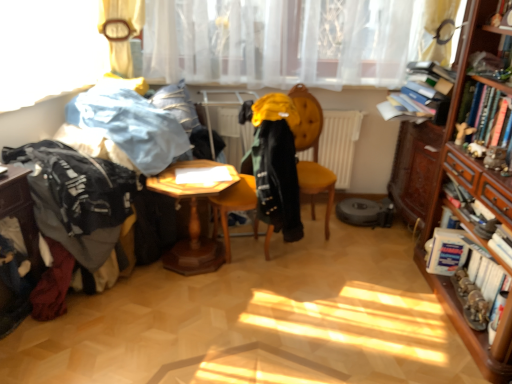
Question: Would you say denim jacket at left, the second clothing viewed from the right, is part of wooden hexagonal table at lower left, the 1th table when ordered from left to right,'s contents?

Choices:
 (A) yes
 (B) no

Answer: (B)

Question: Is wooden hexagonal table at lower left, the 1th table when ordered from left to right, beside denim jacket at left, the 2th clothing in the left-to-right sequence?

Choices:
 (A) no
 (B) yes

Answer: (A)

Question: Does wooden hexagonal table at lower left, which is counted as the second table, starting from the right, have a greater width compared to denim jacket at left, the 2th clothing in the left-to-right sequence?

Choices:
 (A) no
 (B) yes

Answer: (A)

Question: Is wooden hexagonal table at lower left, the 1th table when ordered from left to right, bigger than denim jacket at left, the second clothing viewed from the right?

Choices:
 (A) yes
 (B) no

Answer: (B)

Question: From a real-world perspective, is wooden hexagonal table at lower left, which is counted as the second table, starting from the right, over denim jacket at left, the second clothing viewed from the right?

Choices:
 (A) no
 (B) yes

Answer: (A)

Question: From the image's perspective, is wooden hexagonal table at lower left, which is counted as the second table, starting from the right, below denim jacket at left, the second clothing viewed from the right?

Choices:
 (A) no
 (B) yes

Answer: (B)

Question: Can you confirm if translucent white curtain at upper center is smaller than denim jacket at left, the 2th clothing in the left-to-right sequence?

Choices:
 (A) no
 (B) yes

Answer: (A)

Question: From a real-world perspective, is translucent white curtain at upper center over denim jacket at left, the second clothing viewed from the right?

Choices:
 (A) yes
 (B) no

Answer: (A)

Question: From the image's perspective, does translucent white curtain at upper center appear higher than denim jacket at left, the 2th clothing in the left-to-right sequence?

Choices:
 (A) no
 (B) yes

Answer: (B)

Question: Is denim jacket at left, the 2th clothing in the left-to-right sequence, at the back of translucent white curtain at upper center?

Choices:
 (A) yes
 (B) no

Answer: (B)

Question: Can you confirm if translucent white curtain at upper center is positioned to the left of denim jacket at left, the second clothing viewed from the right?

Choices:
 (A) yes
 (B) no

Answer: (B)

Question: Is translucent white curtain at upper center oriented towards denim jacket at left, the second clothing viewed from the right?

Choices:
 (A) yes
 (B) no

Answer: (B)

Question: Is yellow fabric coat at center, the 3th clothing from the left, shorter than white matte radiator at center?

Choices:
 (A) yes
 (B) no

Answer: (B)